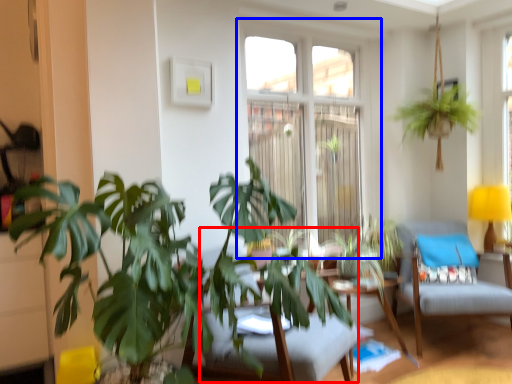
Question: Among these objects, which one is nearest to the camera, swivel chair (highlighted by a red box) or window (highlighted by a blue box)?

Choices:
 (A) swivel chair
 (B) window

Answer: (A)